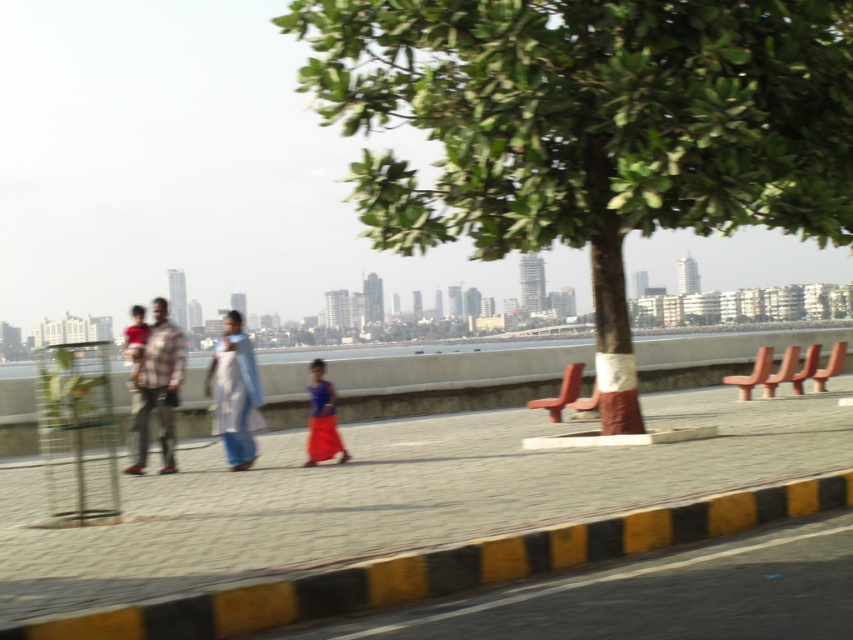
Between green leafy tree at center and matte red shirt at left, which one is positioned higher?

green leafy tree at center

Is point (665, 188) in front of point (141, 324)?

Yes, it is in front of point (141, 324).

Find the location of `green leafy tree at center`. green leafy tree at center is located at coordinates (590, 128).

Between green leafy tree at center and plaid fabric shirt at center, which one has more height?

With more height is plaid fabric shirt at center.

Does point (822, 44) lie behind point (158, 401)?

Yes, point (822, 44) is behind point (158, 401).

Based on the photo, who is more forward, (664, 168) or (137, 404)?

Point (664, 168) is more forward.

This screenshot has height=640, width=853. In order to click on green leafy tree at center in this screenshot , I will do `click(590, 128)`.

Can you confirm if light blue fabric dress at center is positioned above blue fabric dress at center?

Yes.

Can you confirm if light blue fabric dress at center is positioned below blue fabric dress at center?

No, light blue fabric dress at center is not below blue fabric dress at center.

The image size is (853, 640). What do you see at coordinates (235, 392) in the screenshot? I see `light blue fabric dress at center` at bounding box center [235, 392].

The image size is (853, 640). Identify the location of light blue fabric dress at center. (235, 392).